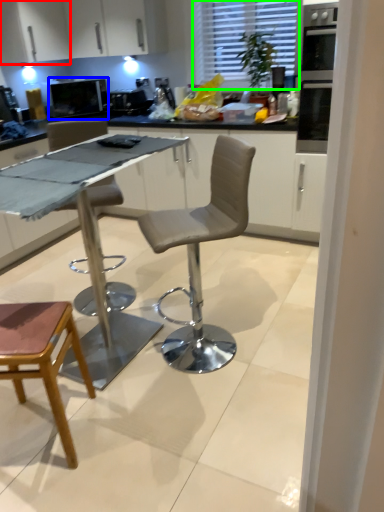
Question: Considering the real-world distances, which object is closest to cabinetry (highlighted by a red box)? appliance (highlighted by a blue box) or window (highlighted by a green box).

Choices:
 (A) appliance
 (B) window

Answer: (A)